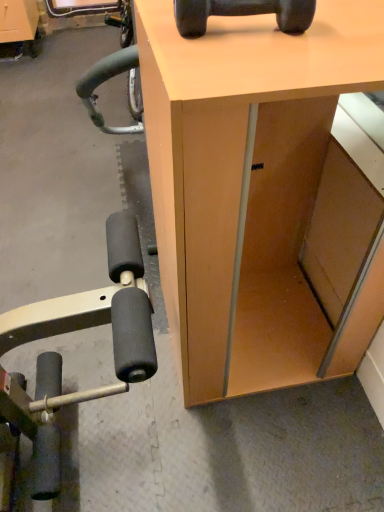
Question: Is black rubber dumbbell at upper center at the back of matte wood desk at center?

Choices:
 (A) no
 (B) yes

Answer: (A)

Question: Can you confirm if matte wood desk at center is taller than black rubber dumbbell at upper center?

Choices:
 (A) no
 (B) yes

Answer: (B)

Question: Can you see matte wood desk at center touching black rubber dumbbell at upper center?

Choices:
 (A) no
 (B) yes

Answer: (A)

Question: From a real-world perspective, is matte wood desk at center located higher than black rubber dumbbell at upper center?

Choices:
 (A) no
 (B) yes

Answer: (A)

Question: Is matte wood desk at center located outside black rubber dumbbell at upper center?

Choices:
 (A) yes
 (B) no

Answer: (A)

Question: From the image's perspective, does matte wood desk at center appear higher than black rubber dumbbell at upper center?

Choices:
 (A) yes
 (B) no

Answer: (B)

Question: Is matte wood desk at center located within black rubber dumbbell at upper center?

Choices:
 (A) no
 (B) yes

Answer: (A)

Question: Does black rubber dumbbell at upper center appear on the right side of matte wood desk at center?

Choices:
 (A) yes
 (B) no

Answer: (B)

Question: Is black rubber dumbbell at upper center smaller than matte wood desk at center?

Choices:
 (A) yes
 (B) no

Answer: (A)

Question: Is black rubber dumbbell at upper center with matte wood desk at center?

Choices:
 (A) no
 (B) yes

Answer: (A)

Question: Is black rubber dumbbell at upper center facing away from matte wood desk at center?

Choices:
 (A) no
 (B) yes

Answer: (A)

Question: Is black rubber dumbbell at upper center taller than matte wood desk at center?

Choices:
 (A) yes
 (B) no

Answer: (B)

Question: Considering the positions of matte wood desk at center and black rubber dumbbell at upper center in the image, is matte wood desk at center taller or shorter than black rubber dumbbell at upper center?

Choices:
 (A) tall
 (B) short

Answer: (A)